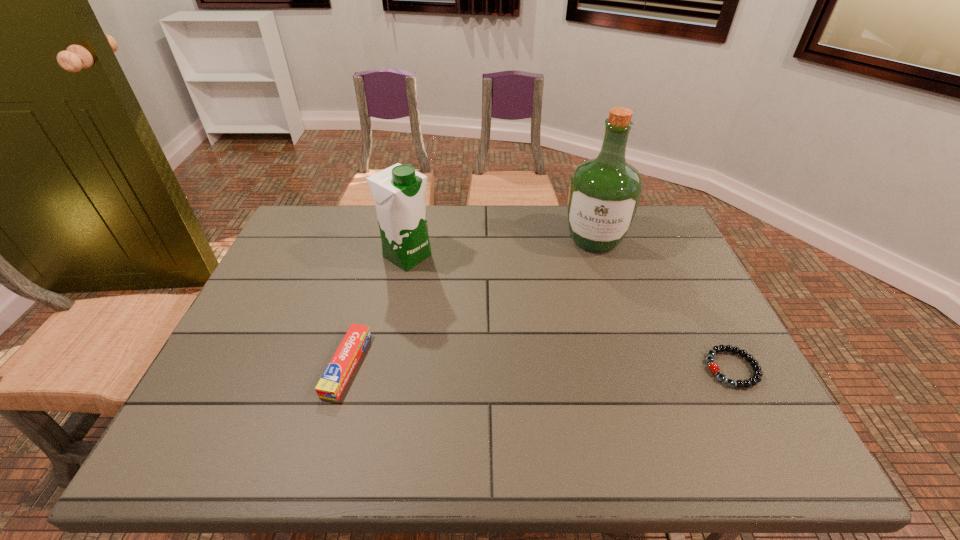
At what (x,y) coordinates should I click in order to perform the action: click on vacant region between the third shortest object and the second shortest object. Please return your answer as a coordinate pair (x, y). The image size is (960, 540). Looking at the image, I should click on (377, 310).

Locate an element on the screen. The width and height of the screenshot is (960, 540). vacant space that's between the rightmost object and the second tallest object is located at coordinates (569, 312).

Where is `empty space that is in between the tallest object and the second tallest object`? This screenshot has width=960, height=540. empty space that is in between the tallest object and the second tallest object is located at coordinates (501, 248).

This screenshot has width=960, height=540. In order to click on vacant space that is in between the rightmost object and the toothpaste in this screenshot , I will do `click(540, 366)`.

Where is `vacant space that's between the third shortest object and the second object from right to left`? vacant space that's between the third shortest object and the second object from right to left is located at coordinates (501, 248).

Identify the location of vacant space in between the shortest object and the toothpaste. (540, 366).

Where is `vacant point located between the soya milk and the liquor`? This screenshot has width=960, height=540. vacant point located between the soya milk and the liquor is located at coordinates (501, 248).

Locate an element on the screen. Image resolution: width=960 pixels, height=540 pixels. free spot between the soya milk and the toothpaste is located at coordinates (377, 310).

Locate an element on the screen. empty location between the liquor and the rightmost object is located at coordinates 663,304.

Find the location of a particular element. This screenshot has height=540, width=960. object that is the third closest to the liquor is located at coordinates click(x=333, y=381).